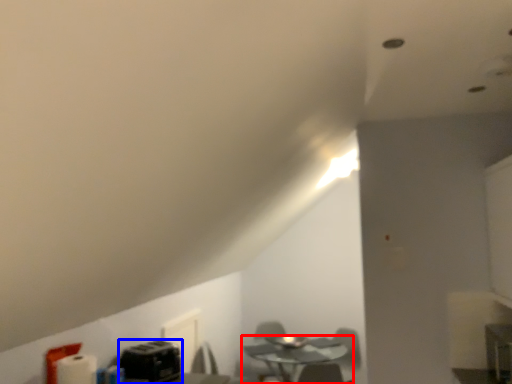
Question: Which object is further to the camera taking this photo, table (highlighted by a red box) or appliance (highlighted by a blue box)?

Choices:
 (A) table
 (B) appliance

Answer: (A)